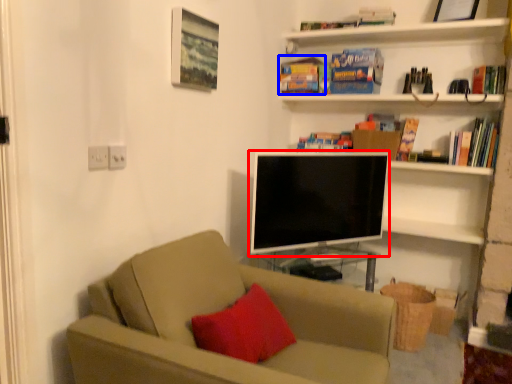
Question: Which object is further to the camera taking this photo, television (highlighted by a red box) or paperback book (highlighted by a blue box)?

Choices:
 (A) television
 (B) paperback book

Answer: (B)